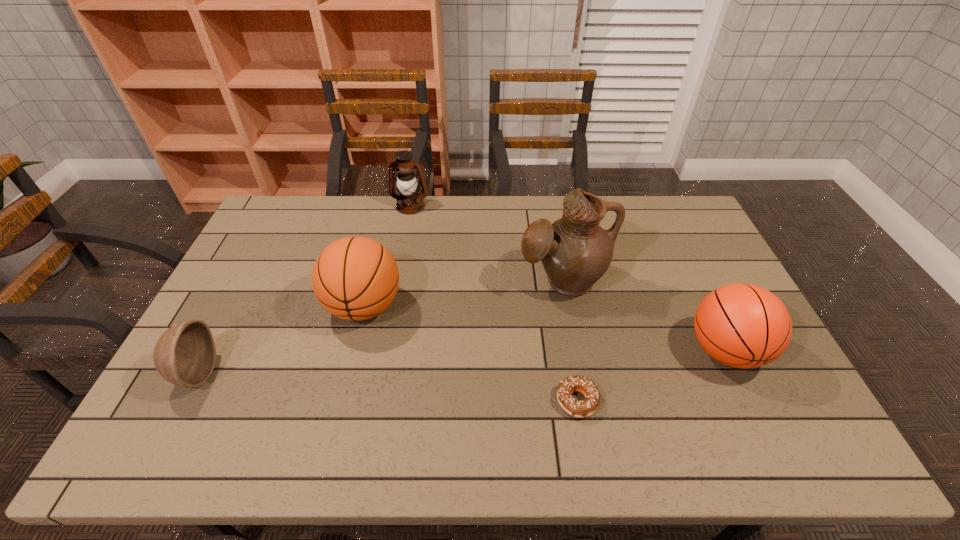
Where is `vacant space positioned 0.320m on the back of the rightmost object`? The height and width of the screenshot is (540, 960). vacant space positioned 0.320m on the back of the rightmost object is located at coordinates (676, 248).

This screenshot has height=540, width=960. Find the location of `free location located 0.330m on the back of the bowl`. free location located 0.330m on the back of the bowl is located at coordinates (253, 265).

Image resolution: width=960 pixels, height=540 pixels. Identify the location of free point located on the right of the doughnut. (734, 401).

This screenshot has width=960, height=540. I want to click on object that is at the far edge, so click(x=409, y=202).

Image resolution: width=960 pixels, height=540 pixels. In order to click on object at the left edge in this screenshot , I will do `click(185, 355)`.

Find the location of `object that is positioned at the right edge`. object that is positioned at the right edge is located at coordinates (741, 325).

In order to click on free space at the far edge of the desktop in this screenshot , I will do `click(558, 218)`.

In the image, there is a desktop. Where is `vacant area at the near edge`? Image resolution: width=960 pixels, height=540 pixels. vacant area at the near edge is located at coordinates (262, 451).

This screenshot has width=960, height=540. What are the coordinates of `free location at the left edge` in the screenshot? It's located at (245, 258).

The width and height of the screenshot is (960, 540). I want to click on vacant area at the right edge of the desktop, so click(699, 273).